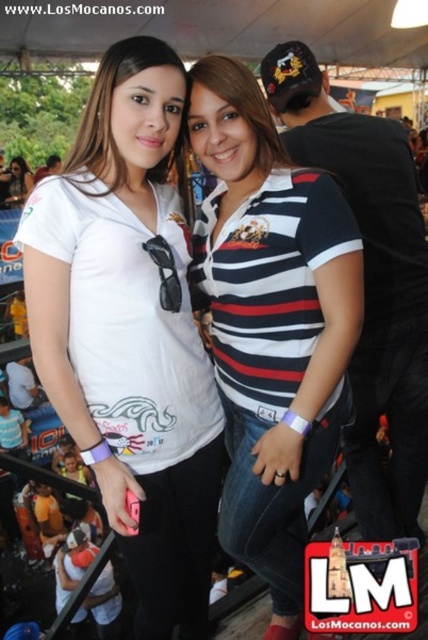
Does striped cotton shirt at center lie in front of matte white shirt at upper left?

Yes, striped cotton shirt at center is closer to the viewer.

Does striped cotton shirt at center have a greater height compared to matte white shirt at upper left?

Yes, striped cotton shirt at center is taller than matte white shirt at upper left.

I want to click on striped cotton shirt at center, so click(272, 323).

What are the coordinates of `striped cotton shirt at center` in the screenshot? It's located at (272, 323).

Between white matte t-shirt at upper left and striped cotton shirt at center, which one has less height?

striped cotton shirt at center is shorter.

Describe the element at coordinates (130, 332) in the screenshot. The image size is (428, 640). I see `white matte t-shirt at upper left` at that location.

Is point (107, 385) positioned behind point (276, 344)?

That is False.

Locate an element on the screen. white matte t-shirt at upper left is located at coordinates (130, 332).

Is white matte t-shirt at upper left closer to camera compared to matte white shirt at upper left?

Yes, white matte t-shirt at upper left is closer to the viewer.

Is white matte t-shirt at upper left behind matte white shirt at upper left?

No, it is in front of matte white shirt at upper left.

Describe the element at coordinates (130, 332) in the screenshot. I see `white matte t-shirt at upper left` at that location.

Where is `white matte t-shirt at upper left`? The image size is (428, 640). white matte t-shirt at upper left is located at coordinates (130, 332).